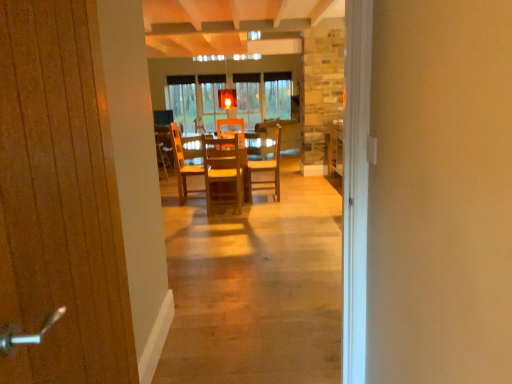
Question: Is wooden chair at center, which appears as the first chair when viewed from the back, next to wooden chair at center, arranged as the 2th chair when viewed from the right?

Choices:
 (A) no
 (B) yes

Answer: (A)

Question: From a real-world perspective, is wooden chair at center, which appears as the first chair when viewed from the back, positioned under wooden chair at center, the second chair in the back-to-front sequence, based on gravity?

Choices:
 (A) no
 (B) yes

Answer: (B)

Question: Does wooden chair at center, arranged as the first chair when viewed from the right, have a lesser width compared to wooden chair at center, which appears as the first chair when viewed from the front?

Choices:
 (A) yes
 (B) no

Answer: (B)

Question: Is wooden chair at center, arranged as the first chair when viewed from the right, facing away from wooden chair at center, the 1th chair positioned from the left?

Choices:
 (A) no
 (B) yes

Answer: (A)

Question: Considering the relative sizes of wooden chair at center, which appears as the first chair when viewed from the back, and wooden chair at center, arranged as the 2th chair when viewed from the right, in the image provided, is wooden chair at center, which appears as the first chair when viewed from the back, bigger than wooden chair at center, arranged as the 2th chair when viewed from the right,?

Choices:
 (A) no
 (B) yes

Answer: (A)

Question: Is wooden door at left inside the boundaries of wooden chair at center, or outside?

Choices:
 (A) outside
 (B) inside

Answer: (A)

Question: Considering their positions, is wooden door at left located in front of or behind wooden chair at center?

Choices:
 (A) front
 (B) behind

Answer: (A)

Question: In terms of size, does wooden door at left appear bigger or smaller than wooden chair at center?

Choices:
 (A) small
 (B) big

Answer: (A)

Question: Is wooden door at left to the left or to the right of wooden chair at center in the image?

Choices:
 (A) left
 (B) right

Answer: (B)

Question: Is wooden chair at center wider or thinner than wooden table at center?

Choices:
 (A) thin
 (B) wide

Answer: (A)

Question: Is wooden chair at center inside or outside of wooden table at center?

Choices:
 (A) inside
 (B) outside

Answer: (B)

Question: From a real-world perspective, is wooden chair at center physically located above or below wooden table at center?

Choices:
 (A) below
 (B) above

Answer: (B)

Question: Relative to wooden table at center, is wooden chair at center in front or behind?

Choices:
 (A) behind
 (B) front

Answer: (A)

Question: Is wooden table at center situated inside wooden chair at center or outside?

Choices:
 (A) outside
 (B) inside

Answer: (A)

Question: Does point (276, 178) appear closer or farther from the camera than point (159, 157)?

Choices:
 (A) closer
 (B) farther

Answer: (B)